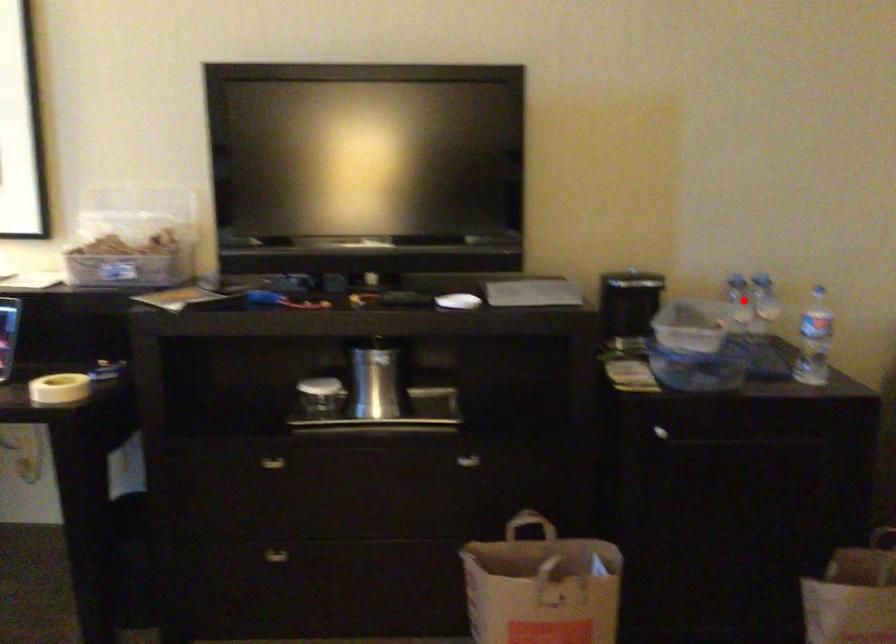
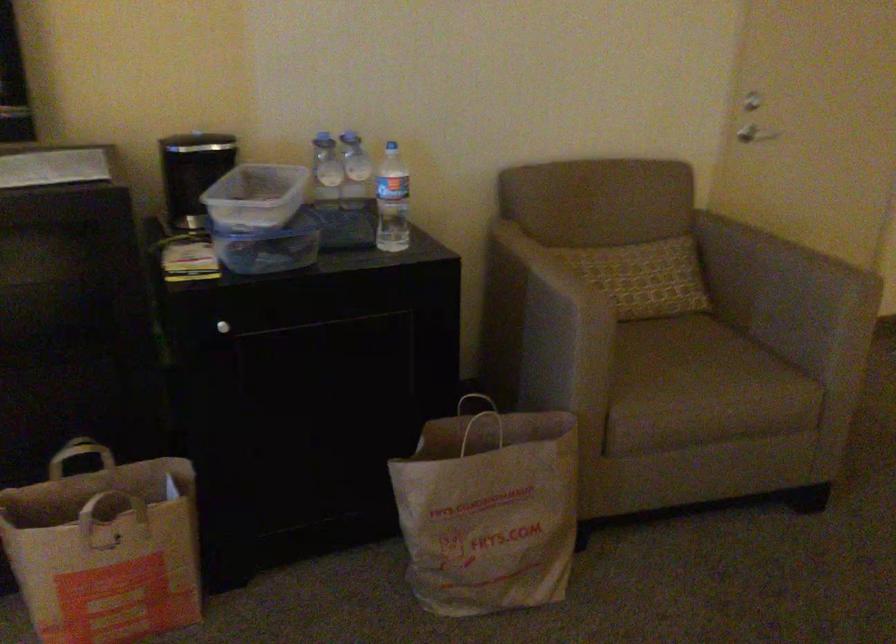
Locate, in the second image, the point that corresponds to the highlighted location in the first image.

(325, 169)